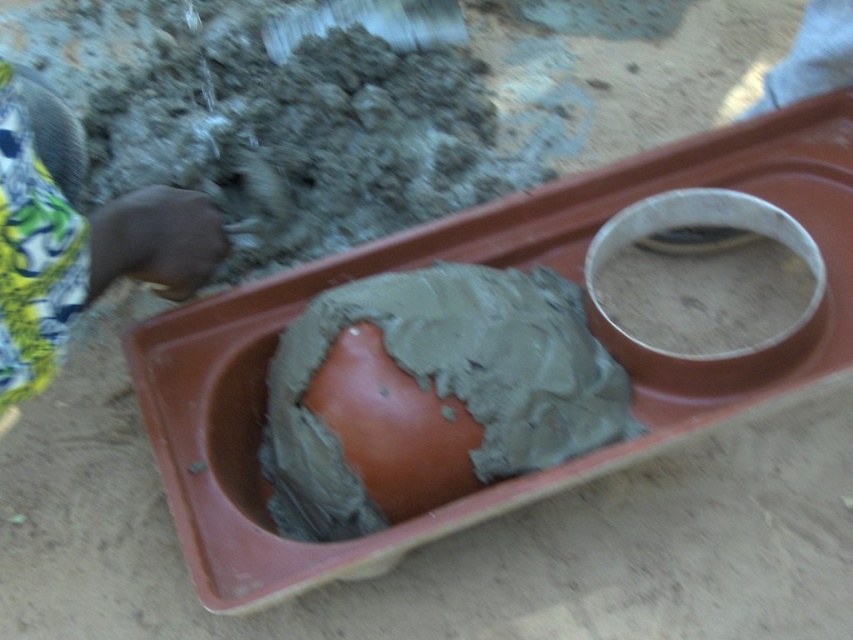
You are a construction worker needing to use the largest available gray matte mud for laying bricks. Which of the two gray matte mud locations should you choose between the gray matte mud at center and the gray matte mud at upper right?

The gray matte mud at center is larger in size than the gray matte mud at upper right, so you should choose the gray matte mud at center for laying bricks.